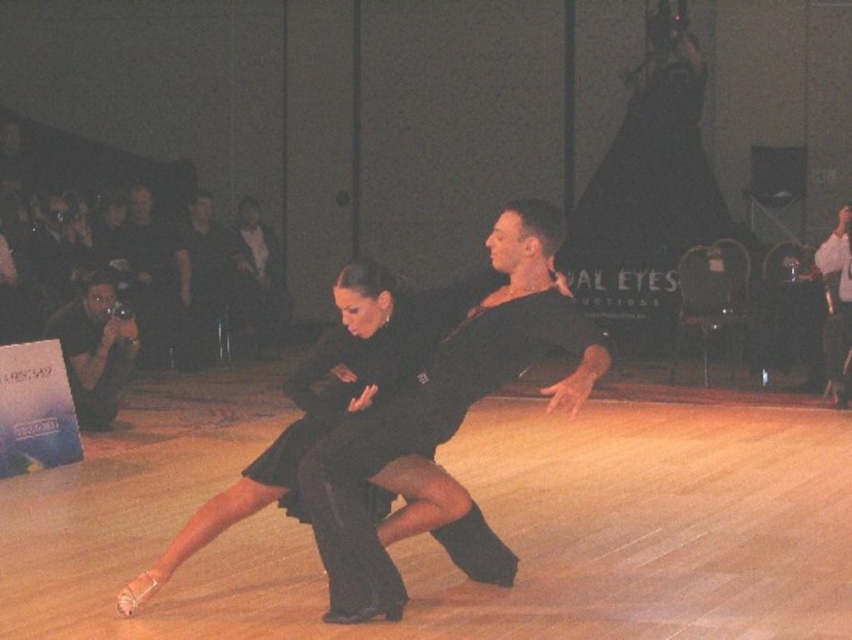
Is black satin dress at center wider than matte black camera at left?

Correct, the width of black satin dress at center exceeds that of matte black camera at left.

Is black satin dress at center smaller than matte black camera at left?

No.

Find the location of `black satin dress at center`. black satin dress at center is located at coordinates (444, 422).

Image resolution: width=852 pixels, height=640 pixels. I want to click on black satin dress at center, so click(444, 422).

In the scene shown: Can you confirm if matte black camera at left is positioned below black satin suit at right?

Correct, matte black camera at left is located below black satin suit at right.

Who is higher up, matte black camera at left or black satin suit at right?

black satin suit at right is higher up.

Locate an element on the screen. The height and width of the screenshot is (640, 852). matte black camera at left is located at coordinates click(96, 348).

Can you confirm if black satin dress at center is shorter than black satin suit at right?

Correct, black satin dress at center is not as tall as black satin suit at right.

Does black satin dress at center come in front of black satin suit at right?

Yes, black satin dress at center is closer to the viewer.

Who is more distant from viewer, (488,390) or (843,376)?

The point (843,376) is behind.

Locate an element on the screen. The width and height of the screenshot is (852, 640). black satin dress at center is located at coordinates (444, 422).